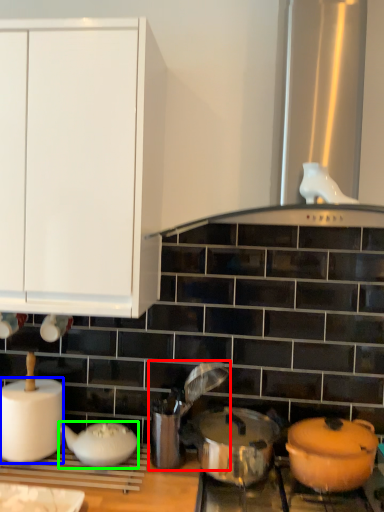
Question: Which is farther away from appliance (highlighted by a red box)? paper towel (highlighted by a blue box) or tableware (highlighted by a green box)?

Choices:
 (A) paper towel
 (B) tableware

Answer: (A)